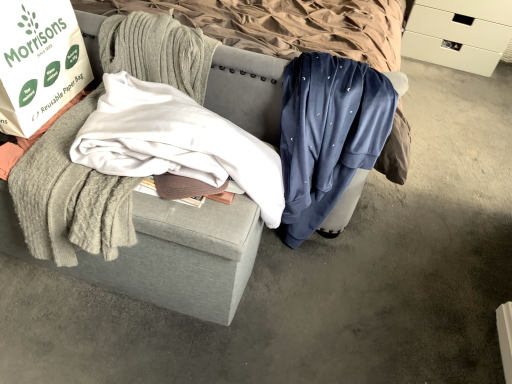
Question: From the image's perspective, does white matte drawer at upper right appear lower than velvet blue sweatpants at center, which is counted as the second clothing, starting from the left?

Choices:
 (A) yes
 (B) no

Answer: (B)

Question: Is white matte drawer at upper right not near velvet blue sweatpants at center, acting as the 1th clothing starting from the right?

Choices:
 (A) yes
 (B) no

Answer: (A)

Question: Can you confirm if white matte drawer at upper right is thinner than velvet blue sweatpants at center, which is counted as the second clothing, starting from the left?

Choices:
 (A) no
 (B) yes

Answer: (A)

Question: Is white matte drawer at upper right oriented towards velvet blue sweatpants at center, acting as the 1th clothing starting from the right?

Choices:
 (A) yes
 (B) no

Answer: (A)

Question: Does white matte drawer at upper right contain velvet blue sweatpants at center, which is counted as the second clothing, starting from the left?

Choices:
 (A) no
 (B) yes

Answer: (A)

Question: Is white matte drawer at upper right taller than velvet blue sweatpants at center, which is counted as the second clothing, starting from the left?

Choices:
 (A) yes
 (B) no

Answer: (B)

Question: Is white paper bag at left next to white cotton shirt at center, the 1th clothing from the left, and touching it?

Choices:
 (A) yes
 (B) no

Answer: (B)

Question: Is white cotton shirt at center, the 1th clothing from the left, completely or partially inside white paper bag at left?

Choices:
 (A) no
 (B) yes

Answer: (A)

Question: Considering the relative positions of white paper bag at left and white cotton shirt at center, the second clothing when ordered from right to left, in the image provided, is white paper bag at left to the left of white cotton shirt at center, the second clothing when ordered from right to left, from the viewer's perspective?

Choices:
 (A) no
 (B) yes

Answer: (B)

Question: From a real-world perspective, is white paper bag at left on top of white cotton shirt at center, the 1th clothing from the left?

Choices:
 (A) yes
 (B) no

Answer: (A)

Question: Can you confirm if white paper bag at left is bigger than white cotton shirt at center, the second clothing when ordered from right to left?

Choices:
 (A) yes
 (B) no

Answer: (B)

Question: Is white paper bag at left closer to camera compared to white cotton shirt at center, the second clothing when ordered from right to left?

Choices:
 (A) yes
 (B) no

Answer: (A)

Question: Does white matte drawer at upper right have a larger size compared to white paper bag at left?

Choices:
 (A) yes
 (B) no

Answer: (A)